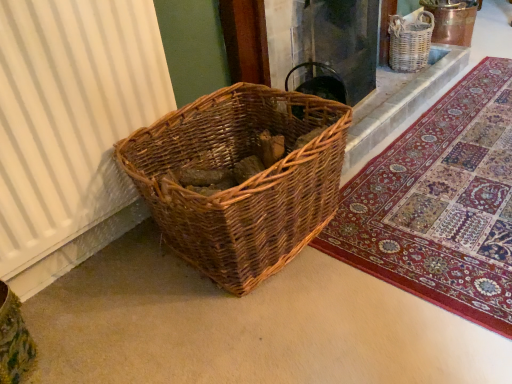
Question: Can you confirm if white ribbed curtain at left is bigger than woven wood basket at lower left?

Choices:
 (A) no
 (B) yes

Answer: (A)

Question: Is white ribbed curtain at left facing away from woven wood basket at lower left?

Choices:
 (A) no
 (B) yes

Answer: (A)

Question: From a real-world perspective, is white ribbed curtain at left under woven wood basket at lower left?

Choices:
 (A) no
 (B) yes

Answer: (A)

Question: Considering the relative sizes of white ribbed curtain at left and woven wood basket at lower left in the image provided, is white ribbed curtain at left taller than woven wood basket at lower left?

Choices:
 (A) no
 (B) yes

Answer: (B)

Question: Is white ribbed curtain at left directly adjacent to woven wood basket at lower left?

Choices:
 (A) no
 (B) yes

Answer: (A)

Question: Is woven wood basket at lower left taller or shorter than woven brown basket at upper right?

Choices:
 (A) short
 (B) tall

Answer: (B)

Question: From the image's perspective, is woven wood basket at lower left positioned above or below woven brown basket at upper right?

Choices:
 (A) above
 (B) below

Answer: (B)

Question: Is point (316, 104) positioned closer to the camera than point (420, 51)?

Choices:
 (A) farther
 (B) closer

Answer: (B)

Question: In the image, is woven wood basket at lower left positioned in front of or behind woven brown basket at upper right?

Choices:
 (A) front
 (B) behind

Answer: (A)

Question: Is point (27, 139) closer or farther from the camera than point (425, 231)?

Choices:
 (A) farther
 (B) closer

Answer: (B)

Question: Is white ribbed curtain at left bigger or smaller than rich tapestry rug at lower right?

Choices:
 (A) big
 (B) small

Answer: (B)

Question: Is white ribbed curtain at left taller or shorter than rich tapestry rug at lower right?

Choices:
 (A) tall
 (B) short

Answer: (A)

Question: Looking at their shapes, would you say white ribbed curtain at left is wider or thinner than rich tapestry rug at lower right?

Choices:
 (A) thin
 (B) wide

Answer: (A)

Question: From a real-world perspective, is woven brown basket at upper right positioned above or below woven wood basket at upper center?

Choices:
 (A) below
 (B) above

Answer: (A)

Question: From the image's perspective, is woven brown basket at upper right positioned above or below woven wood basket at upper center?

Choices:
 (A) above
 (B) below

Answer: (A)